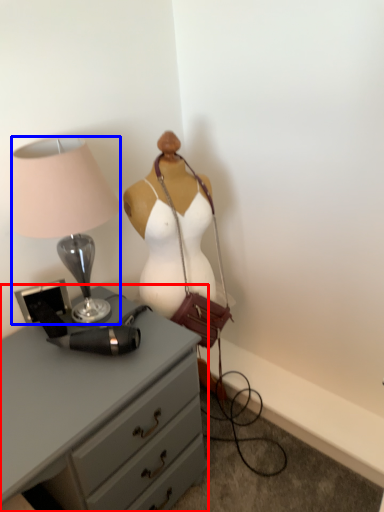
Question: Which point is closer to the camera, chest of drawers (highlighted by a red box) or lamp (highlighted by a blue box)?

Choices:
 (A) chest of drawers
 (B) lamp

Answer: (A)